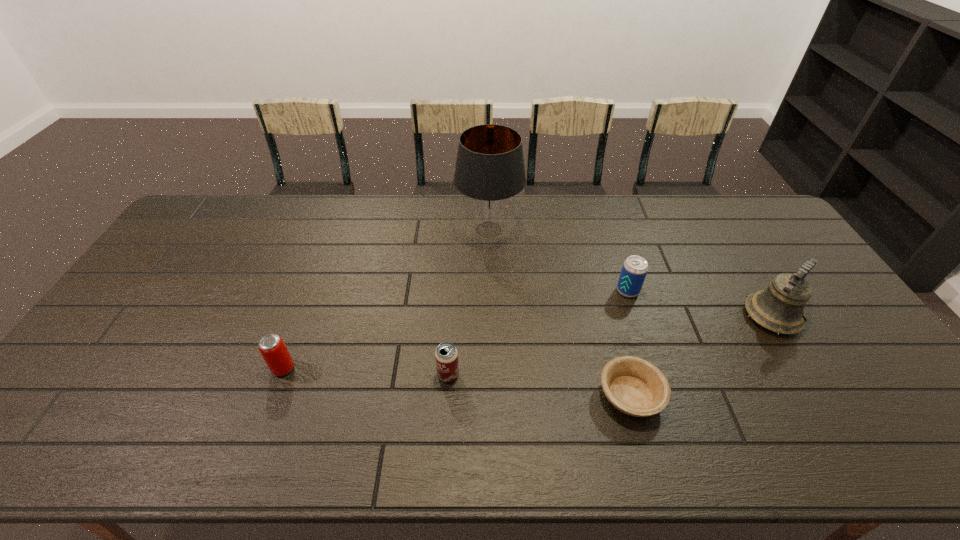
Find the location of a particular element. the closest object to the leftmost beer can is located at coordinates (446, 355).

The height and width of the screenshot is (540, 960). Identify the location of the closest object to the farthest beer can. (635, 386).

Where is `beer can that is the nearest to the bell`? beer can that is the nearest to the bell is located at coordinates (634, 270).

Where is `beer can that is the closest to the bowl`? The width and height of the screenshot is (960, 540). beer can that is the closest to the bowl is located at coordinates (634, 270).

Where is `blank space that satisfies the following two spatial constraints: 1. on the back side of the leftmost beer can; 2. on the left side of the tallest object`? The image size is (960, 540). blank space that satisfies the following two spatial constraints: 1. on the back side of the leftmost beer can; 2. on the left side of the tallest object is located at coordinates (334, 230).

In order to click on blank space that satisfies the following two spatial constraints: 1. on the front side of the second tallest object; 2. on the left side of the farthest object in this screenshot , I will do `click(491, 316)`.